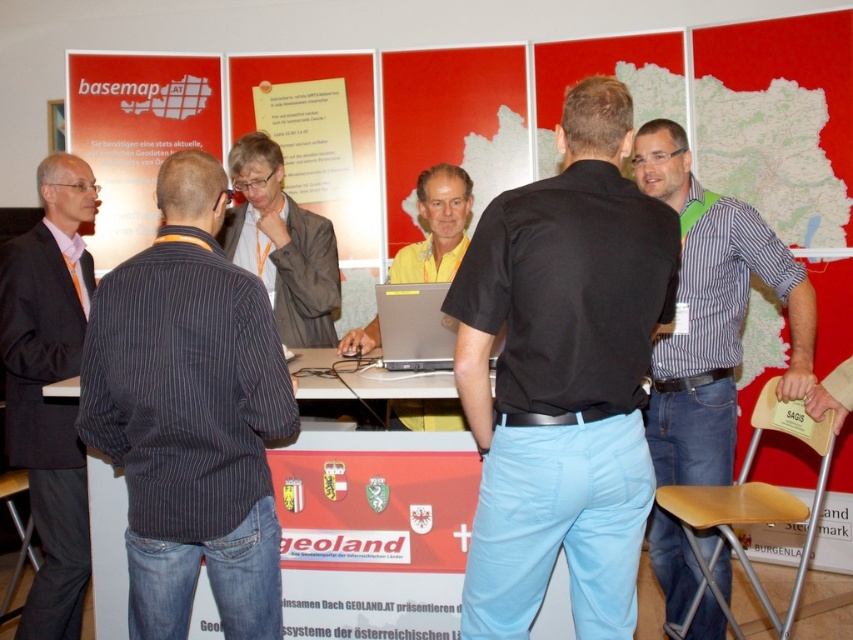
Question: Does matte gray shirt at center have a lesser width compared to yellow matte shirt at center?

Choices:
 (A) yes
 (B) no

Answer: (B)

Question: Can you confirm if matte gray shirt at center is smaller than wooden stool at lower left?

Choices:
 (A) yes
 (B) no

Answer: (A)

Question: Which of these objects is positioned closest to the orange tie at left?

Choices:
 (A) matte paper poster at upper left
 (B) yellow matte shirt at center

Answer: (B)

Question: Considering the real-world distances, which object is farthest from the yellow fabric at center?

Choices:
 (A) matte gray shirt at center
 (B) white glossy table at center

Answer: (B)

Question: Which point is farther from the camera taking this photo?

Choices:
 (A) (480, 205)
 (B) (138, 172)
 (C) (349, 76)

Answer: (C)

Question: From the image, what is the correct spatial relationship of orange tie at left in relation to wooden stool at lower right?

Choices:
 (A) right
 (B) left

Answer: (B)